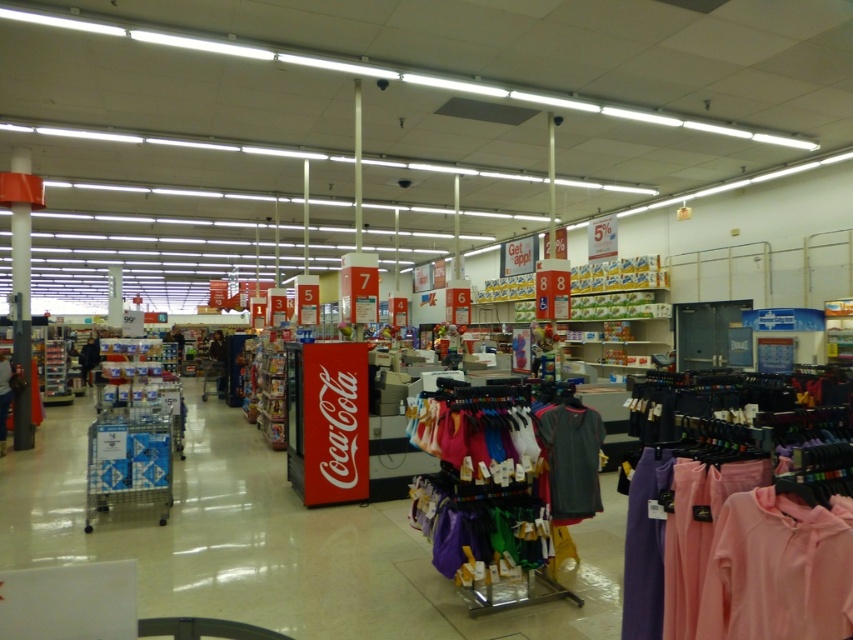
Question: Which point appears farthest from the camera in this image?

Choices:
 (A) (94, 349)
 (B) (717, 588)
 (C) (585, 417)

Answer: (A)

Question: Which object is positioned closest to the dark gray jersey at center?

Choices:
 (A) pink fabric hoodie at lower right
 (B) matte black hoodie at center

Answer: (A)

Question: Which of the following is the farthest from the observer?

Choices:
 (A) matte black jacket at center
 (B) matte black hoodie at center

Answer: (A)

Question: Is pink fabric hoodie at lower right bigger than matte black hoodie at center?

Choices:
 (A) no
 (B) yes

Answer: (A)

Question: Does pink fabric hoodie at lower right have a lesser width compared to dark gray jersey at center?

Choices:
 (A) yes
 (B) no

Answer: (A)

Question: Considering the relative positions of pink fabric hoodie at lower right and matte black hoodie at center in the image provided, where is pink fabric hoodie at lower right located with respect to matte black hoodie at center?

Choices:
 (A) right
 (B) left

Answer: (A)